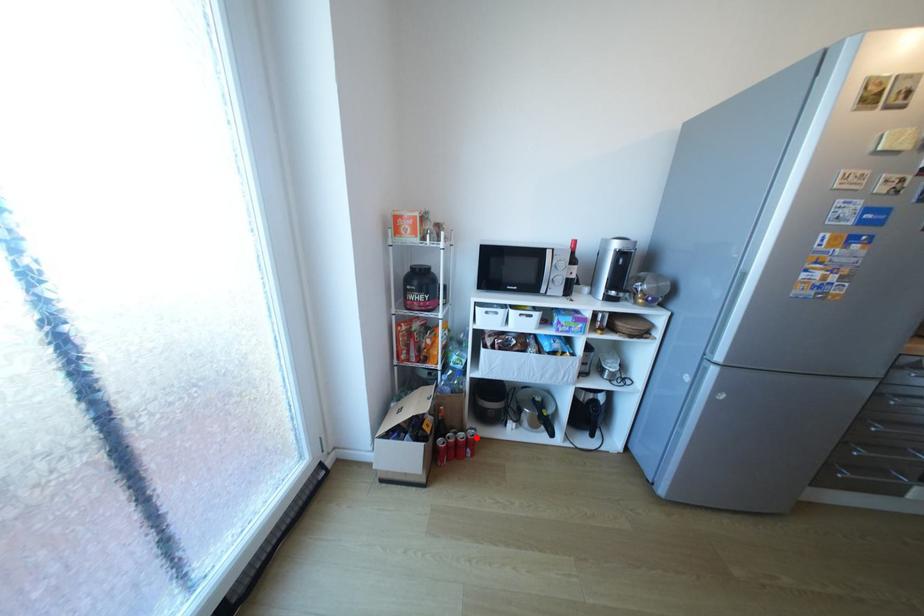
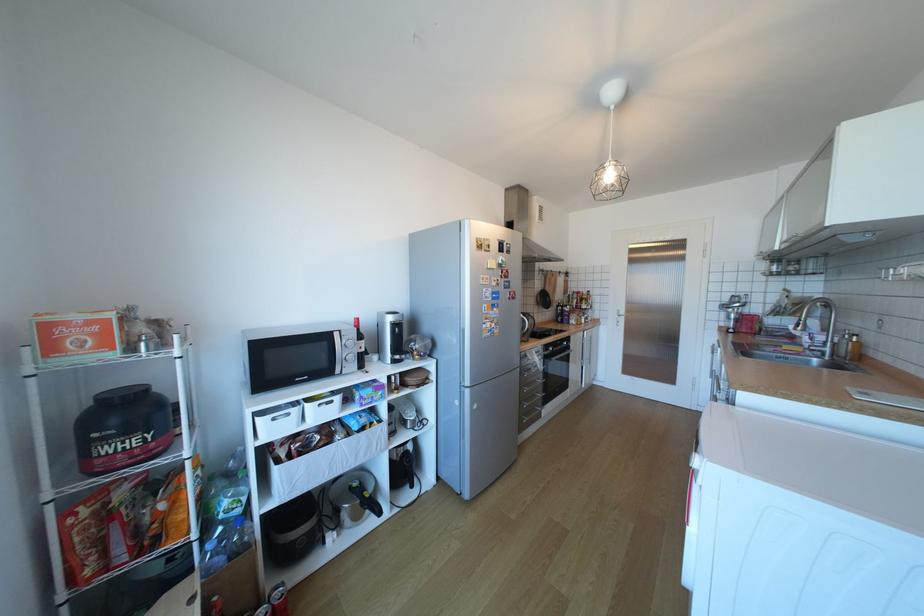
Question: I am providing you with two images of the same scene from different viewpoints. Image1 has a red point marked. In image2, the corresponding 3D location appears at what relative position? Reply with the corresponding letter.

Choices:
 (A) Closer
 (B) Farther

Answer: (A)